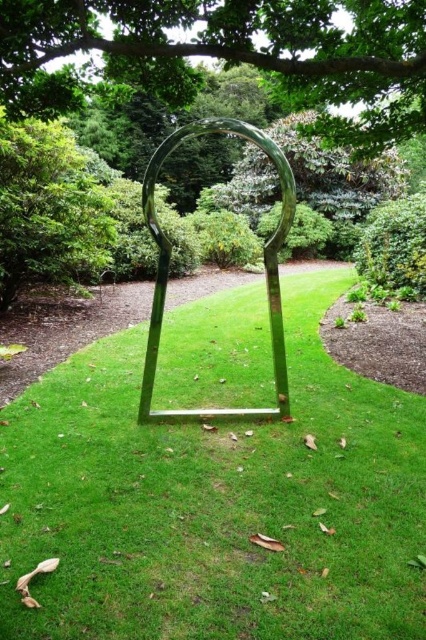
Question: Does green leafy tree at center have a greater width compared to polished metal arch at center?

Choices:
 (A) yes
 (B) no

Answer: (A)

Question: Which object appears closest to the camera in this image?

Choices:
 (A) green leafy tree at upper center
 (B) green metallic frame at center

Answer: (B)

Question: Is the position of green metallic frame at center less distant than that of green leafy tree at center?

Choices:
 (A) yes
 (B) no

Answer: (A)

Question: Is the position of green leafy tree at upper center less distant than that of green leafy tree at center?

Choices:
 (A) no
 (B) yes

Answer: (B)

Question: Which of these objects is positioned closest to the green leafy tree at upper center?

Choices:
 (A) green leafy tree at center
 (B) polished metal arch at center
 (C) green metallic frame at center

Answer: (B)

Question: Which object is positioned closest to the green metallic frame at center?

Choices:
 (A) polished metal arch at center
 (B) green leafy tree at center
 (C) green leafy tree at upper center

Answer: (A)